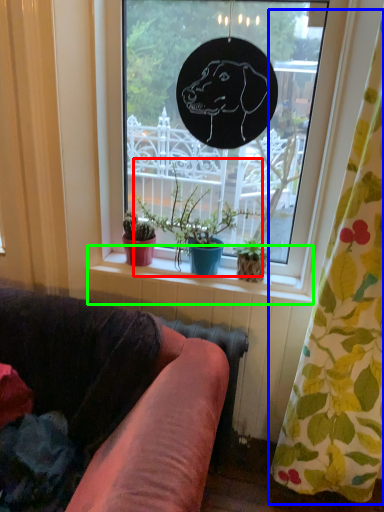
Question: Estimate the real-world distances between objects in this image. Which object is farther from houseplant (highlighted by a red box), curtain (highlighted by a blue box) or window sill (highlighted by a green box)?

Choices:
 (A) curtain
 (B) window sill

Answer: (A)